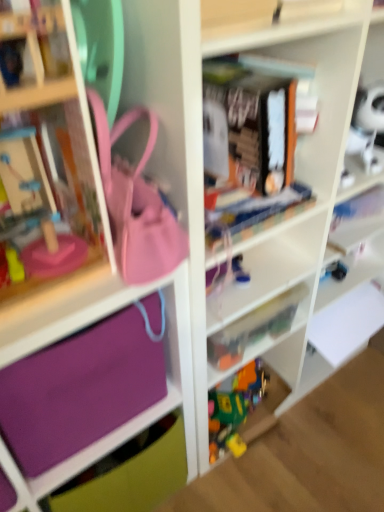
Question: Relative to purple fabric bag at left, which is the 2th cabinet from left to right, is matte pink purse at center in front or behind?

Choices:
 (A) front
 (B) behind

Answer: (A)

Question: In terms of size, does matte pink purse at center appear bigger or smaller than purple fabric bag at left, which appears as the first cabinet when viewed from the right?

Choices:
 (A) small
 (B) big

Answer: (A)

Question: Estimate the real-world distances between objects in this image. Which object is farther from the purple fabric bag at left, which appears as the first cabinet when viewed from the right?

Choices:
 (A) matte pink purse at center
 (B) blue rubber toy at center
 (C) purple fabric at lower left, which appears as the second cabinet when viewed from the right
 (D) translucent plastic toys at center

Answer: (A)

Question: Estimate the real-world distances between objects in this image. Which object is farther from the purple fabric bag at left, which appears as the first cabinet when viewed from the right?

Choices:
 (A) matte pink purse at center
 (B) translucent plastic toys at center
 (C) purple fabric at lower left, placed as the first cabinet when sorted from left to right
 (D) blue rubber toy at center

Answer: (A)